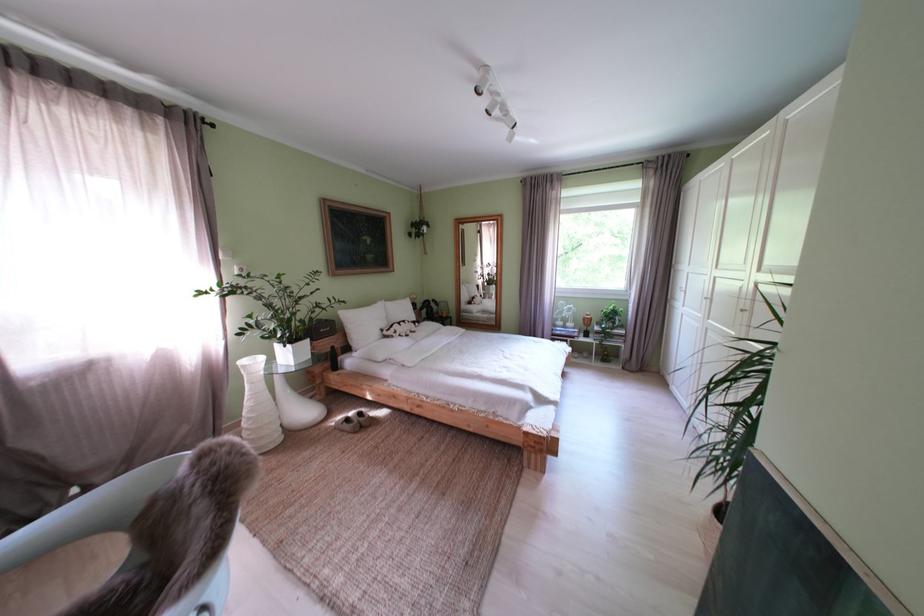
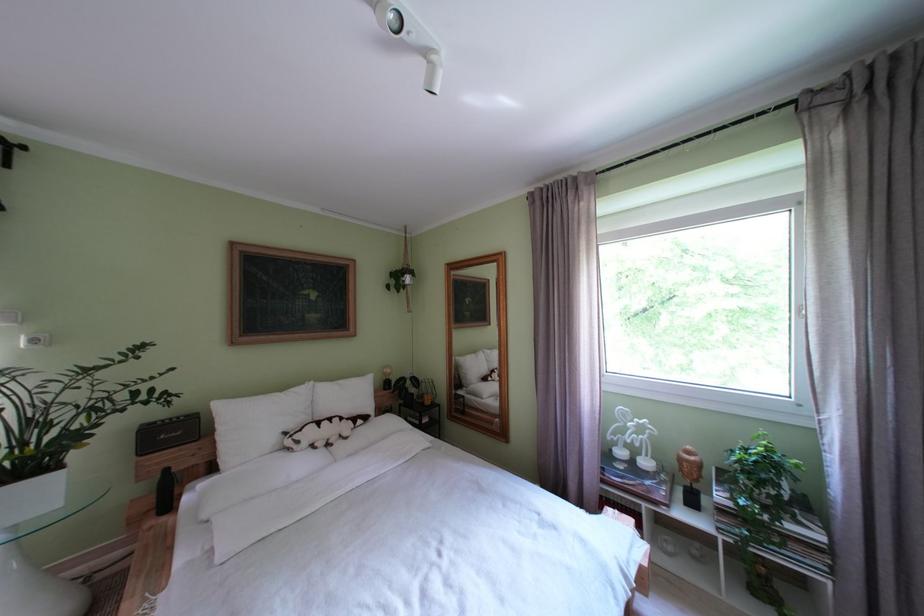
Which direction would the cameraman need to move to produce the second image?

The cameraman walked toward right, forward.